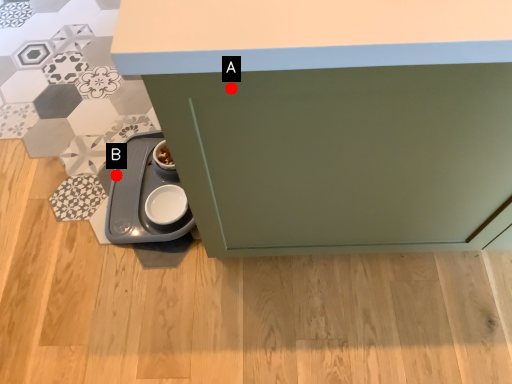
Question: Two points are circled on the image, labeled by A and B beside each circle. Which point is closer to the camera?

Choices:
 (A) A is closer
 (B) B is closer

Answer: (A)